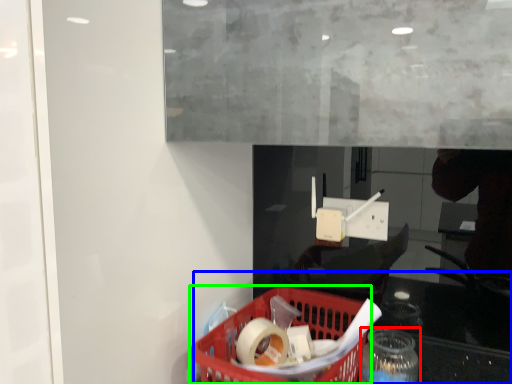
Question: Considering the real-world distances, which object is farthest from bottle (highlighted by a red box)? table (highlighted by a blue box) or basket (highlighted by a green box)?

Choices:
 (A) table
 (B) basket

Answer: (B)